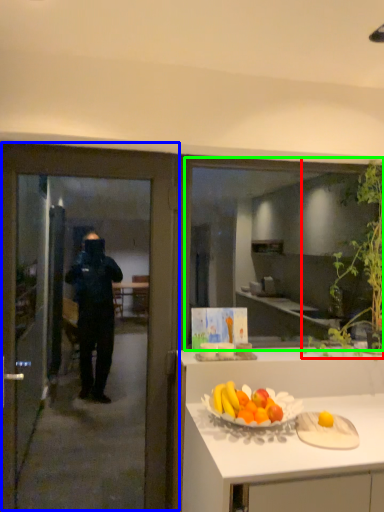
Question: Which is farther away from plant (highlighted by a red box)? door (highlighted by a blue box) or window (highlighted by a green box)?

Choices:
 (A) door
 (B) window

Answer: (B)